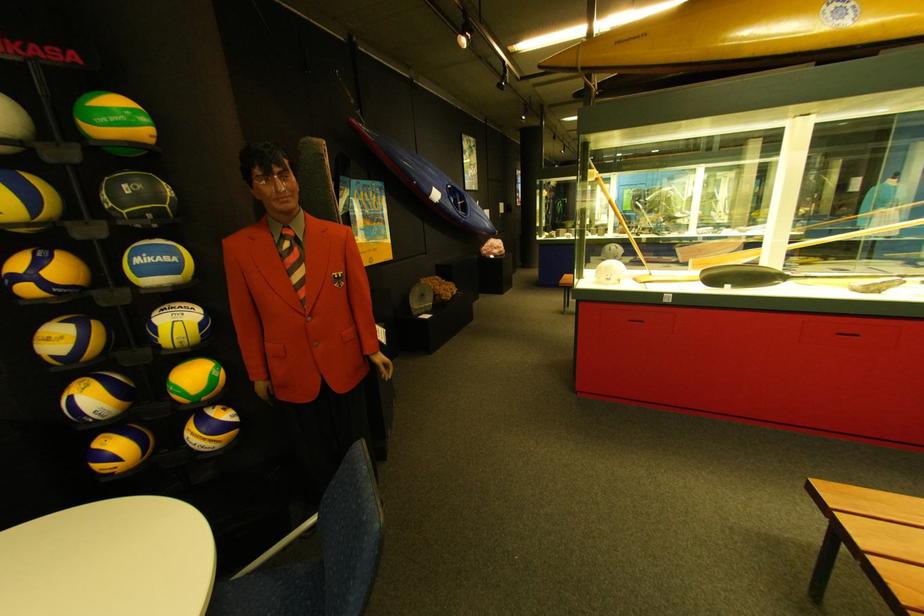
Describe the element at coordinates (114, 121) in the screenshot. Image resolution: width=924 pixels, height=616 pixels. I see `the green and yellow volleyball` at that location.